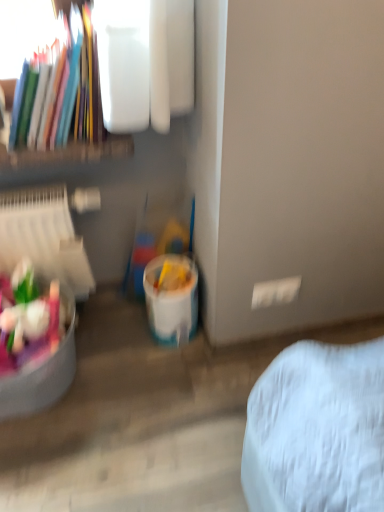
What are the coordinates of `vacant area that lies between matte plastic toys at lower left and white plastic bucket at lower center` in the screenshot? It's located at (115, 354).